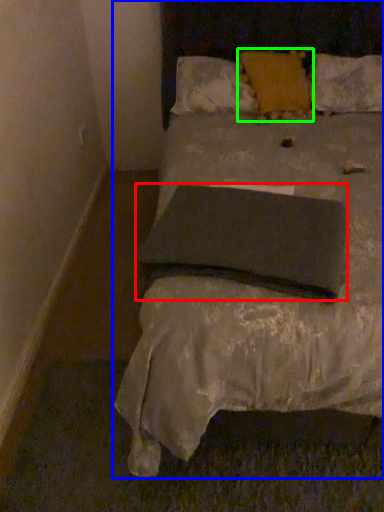
Question: Which object is the closest to the pillow (highlighted by a red box)? Choose among these: bed (highlighted by a blue box) or pillow (highlighted by a green box).

Choices:
 (A) bed
 (B) pillow

Answer: (A)